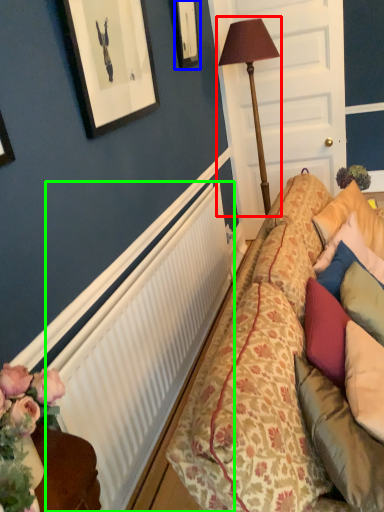
Question: Which object is positioned closest to table lamp (highlighted by a red box)? Select from picture frame (highlighted by a blue box) and radiator (highlighted by a green box).

Choices:
 (A) picture frame
 (B) radiator

Answer: (A)